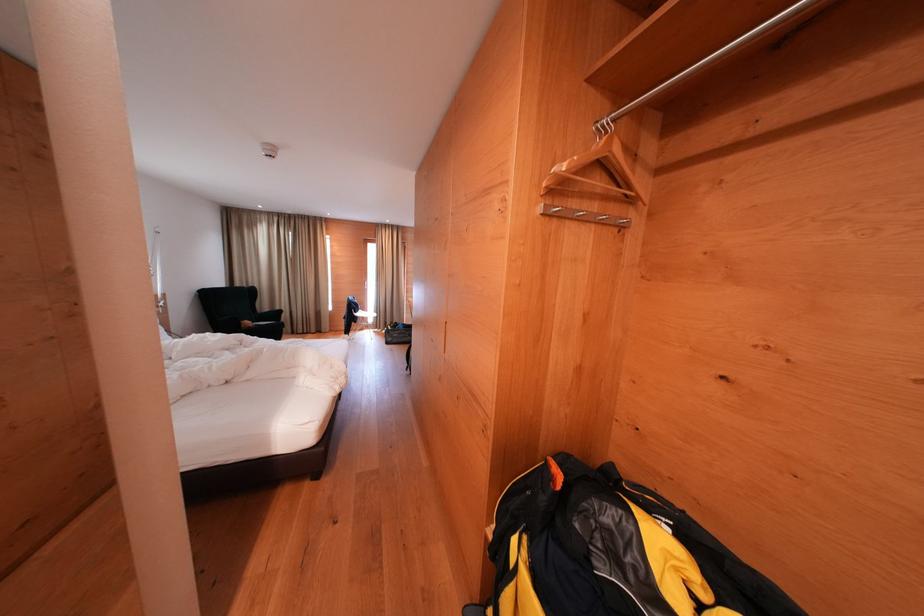
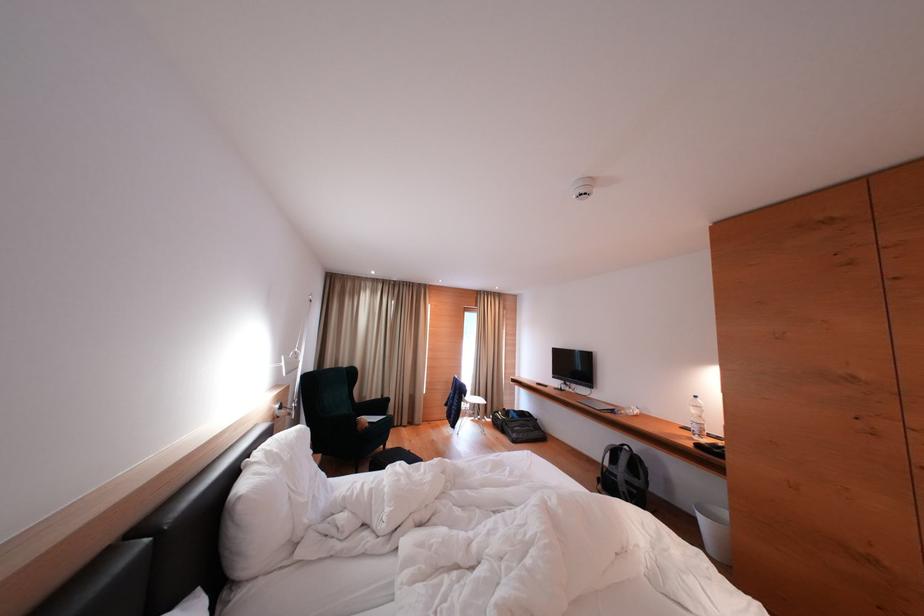
Find the pixel in the second image that matches (247,329) in the first image.

(362, 428)